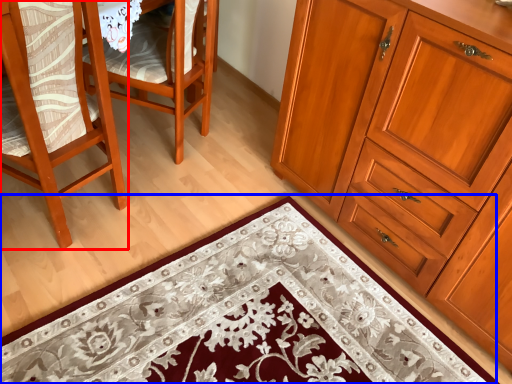
Question: Among these objects, which one is nearest to the camera, chair (highlighted by a red box) or doormat (highlighted by a blue box)?

Choices:
 (A) chair
 (B) doormat

Answer: (B)